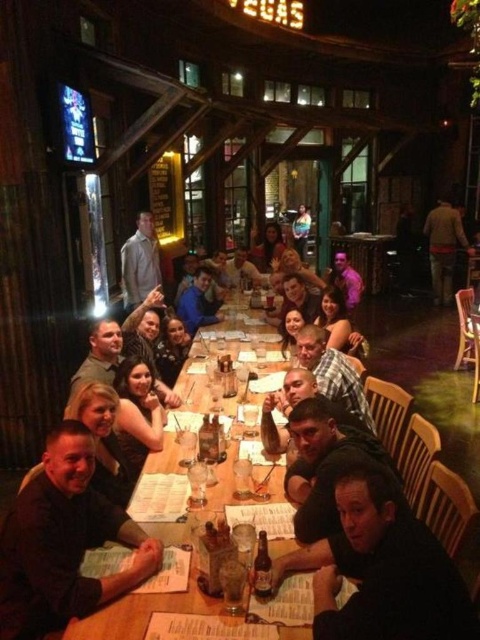
Does matte black shirt at lower right have a lesser height compared to plaid shirt at center?

Correct, matte black shirt at lower right is not as tall as plaid shirt at center.

Who is more forward, [476,630] or [336,388]?

Point [476,630] is in front.

This screenshot has width=480, height=640. What are the coordinates of `matte black shirt at lower right` in the screenshot? It's located at (387, 570).

Between matte black shirt at lower right and light brown leather jacket at upper center, which one is positioned higher?

light brown leather jacket at upper center

The height and width of the screenshot is (640, 480). What do you see at coordinates (387, 570) in the screenshot? I see `matte black shirt at lower right` at bounding box center [387, 570].

Where is `matte black shirt at lower right`? The height and width of the screenshot is (640, 480). matte black shirt at lower right is located at coordinates (387, 570).

Locate an element on the screen. matte black shirt at lower right is located at coordinates (387, 570).

Does matte black shirt at lower left have a greater height compared to plaid shirt at center?

Yes, matte black shirt at lower left is taller than plaid shirt at center.

Can you confirm if matte black shirt at lower left is smaller than plaid shirt at center?

Indeed, matte black shirt at lower left has a smaller size compared to plaid shirt at center.

Does point (64, 621) lie in front of point (364, 397)?

Yes, point (64, 621) is closer to viewer.

Where is `matte black shirt at lower left`? The image size is (480, 640). matte black shirt at lower left is located at coordinates (63, 541).